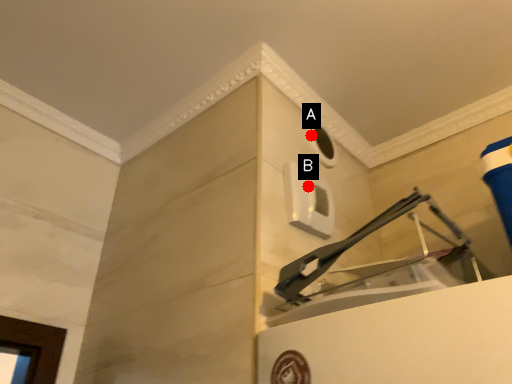
Question: Two points are circled on the image, labeled by A and B beside each circle. Which of the following is the closest to the observer?

Choices:
 (A) A is closer
 (B) B is closer

Answer: (B)